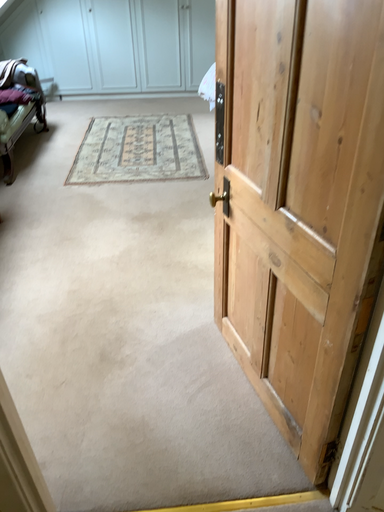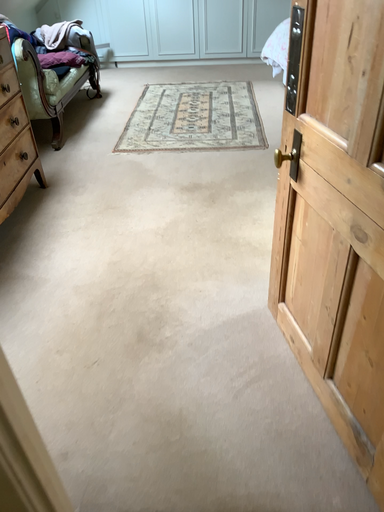
Question: Which way did the camera rotate in the video?

Choices:
 (A) rotated right
 (B) rotated left

Answer: (B)